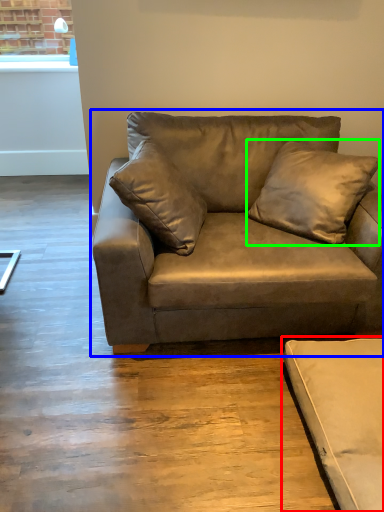
Question: Which is farther away from studio couch (highlighted by a red box)? studio couch (highlighted by a blue box) or pillow (highlighted by a green box)?

Choices:
 (A) studio couch
 (B) pillow

Answer: (B)